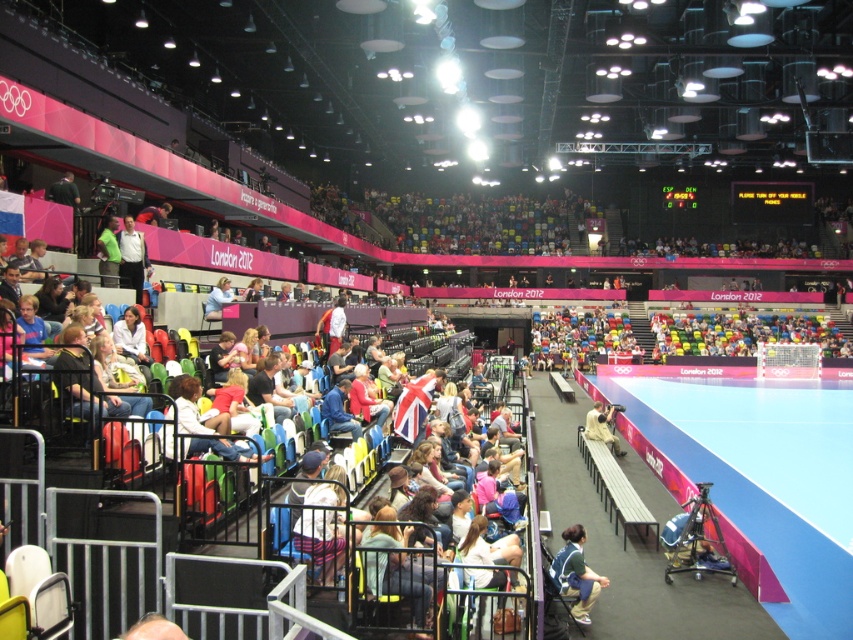
Between dark green fabric jacket at lower center and khaki fabric jacket at center, which one appears on the left side from the viewer's perspective?

From the viewer's perspective, dark green fabric jacket at lower center appears more on the left side.

Can you confirm if dark green fabric jacket at lower center is smaller than khaki fabric jacket at center?

Yes.

You are a GUI agent. You are given a task and a screenshot of the screen. Output one action in this format:
    pyautogui.click(x=<x>, y=<y>)
    Task: Click on the dark green fabric jacket at lower center
    Image resolution: width=853 pixels, height=640 pixels.
    Given the screenshot: What is the action you would take?
    pyautogui.click(x=576, y=573)

Who is more forward, (x=225, y=440) or (x=570, y=570)?

Point (x=225, y=440)

Who is more distant from viewer, [189,410] or [595,579]?

Result: Point [595,579]

You are a GUI agent. You are given a task and a screenshot of the screen. Output one action in this format:
    pyautogui.click(x=<x>, y=<y>)
    Task: Click on the white fabric jacket at center
    This screenshot has width=853, height=640.
    Given the screenshot: What is the action you would take?
    pyautogui.click(x=195, y=408)

This screenshot has height=640, width=853. In order to click on white fabric jacket at center in this screenshot , I will do `click(195, 408)`.

Is white fabric jacket at center bigger than khaki fabric jacket at center?

Yes.

Find the location of a particular element. white fabric jacket at center is located at coordinates (195, 408).